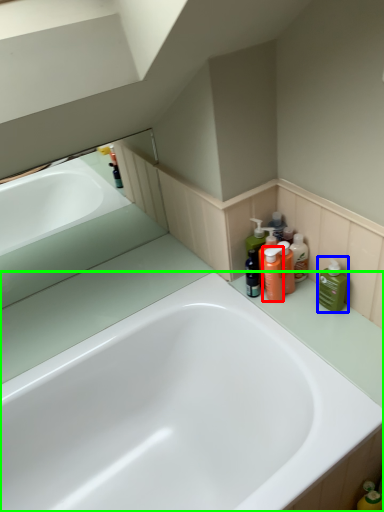
Question: Which object is positioned closest to cleaning product (highlighted by a red box)? Select from cleaning product (highlighted by a blue box) and bathtub (highlighted by a green box).

Choices:
 (A) cleaning product
 (B) bathtub

Answer: (A)